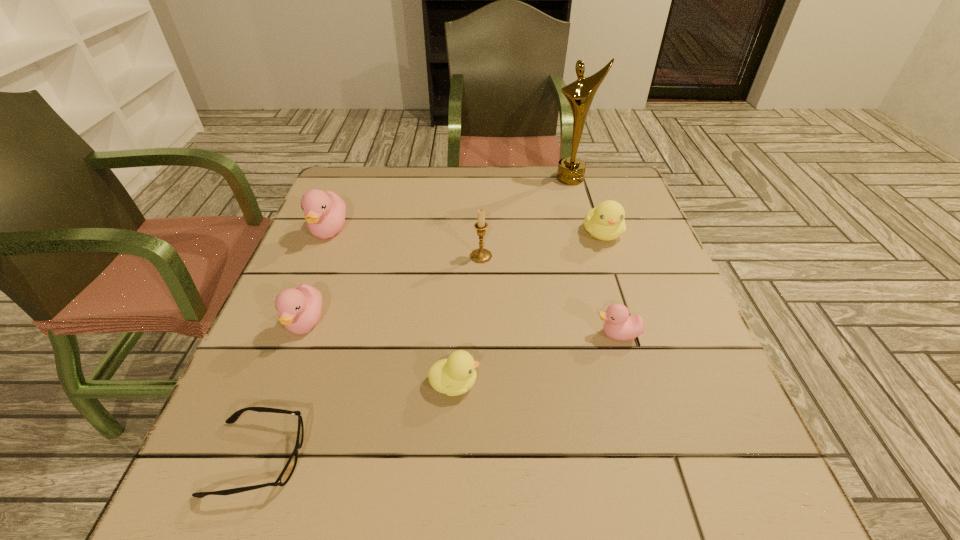
I want to click on award, so click(571, 170).

What are the coordinates of `the farthest object` in the screenshot? It's located at [x=571, y=170].

Where is `candle holder`? candle holder is located at coordinates (480, 255).

Find the location of a particular element. the tallest duckling is located at coordinates (325, 211).

The width and height of the screenshot is (960, 540). What are the coordinates of `the farthest pink duckling` in the screenshot? It's located at (325, 211).

Where is `the farther yellow duckling`? Image resolution: width=960 pixels, height=540 pixels. the farther yellow duckling is located at coordinates (605, 222).

Image resolution: width=960 pixels, height=540 pixels. In order to click on the right yellow duckling in this screenshot , I will do `click(605, 222)`.

I want to click on the second smallest pink duckling, so click(x=299, y=309).

Locate an element on the screen. The width and height of the screenshot is (960, 540). the seventh farthest object is located at coordinates (454, 376).

The image size is (960, 540). I want to click on the third duckling from left to right, so click(x=454, y=376).